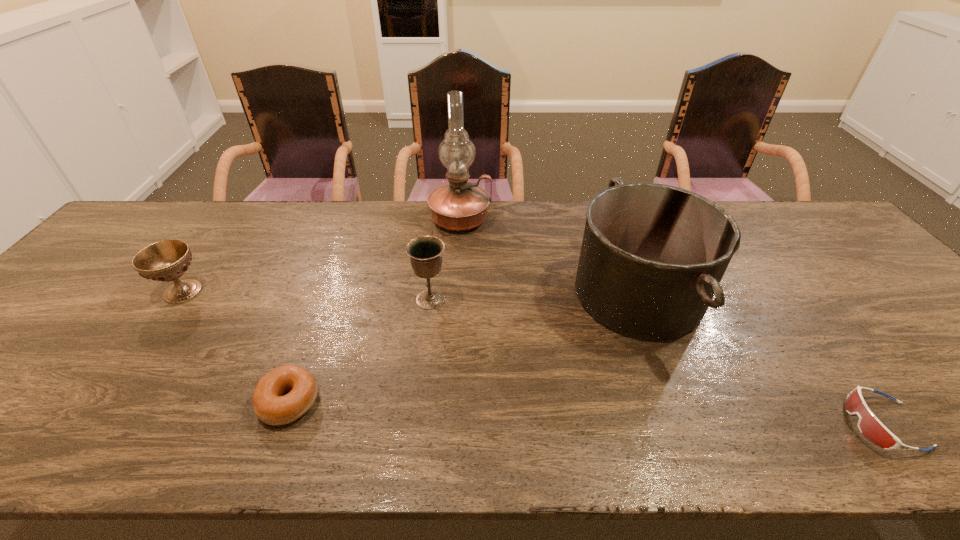
Identify the location of free space that satisfies the following two spatial constraints: 1. on the back side of the taller chalice; 2. on the left side of the second object from left to right. This screenshot has width=960, height=540. (326, 299).

I want to click on blank space that satisfies the following two spatial constraints: 1. on the front side of the oil lamp; 2. on the right side of the pan, so click(x=456, y=294).

Where is `vacant space that satisfies the following two spatial constraints: 1. on the back side of the oil lamp; 2. on the left side of the third shortest object`? The height and width of the screenshot is (540, 960). vacant space that satisfies the following two spatial constraints: 1. on the back side of the oil lamp; 2. on the left side of the third shortest object is located at coordinates (235, 219).